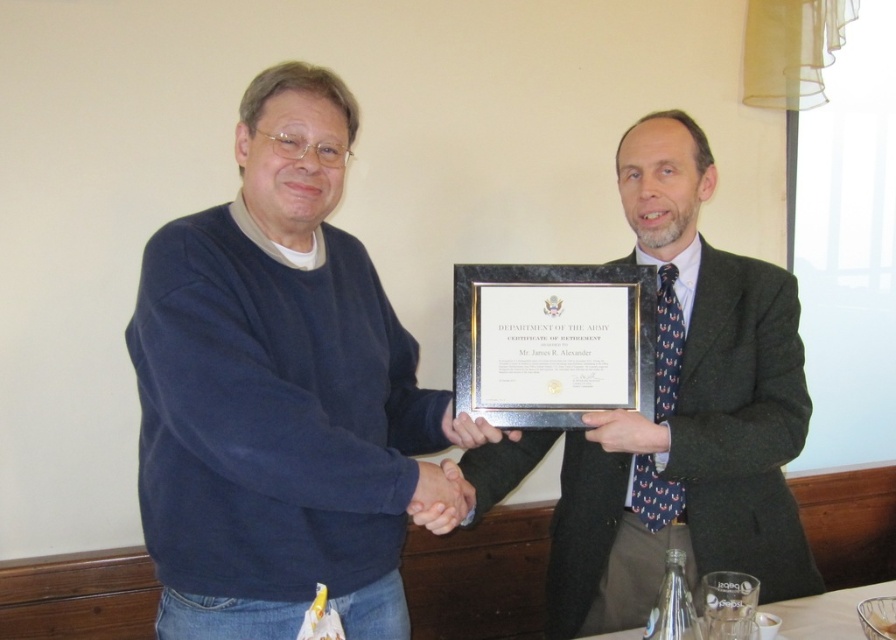
Between matte blue sweater at center and dark gray suit at center, which one appears on the right side from the viewer's perspective?

dark gray suit at center

The image size is (896, 640). In order to click on matte blue sweater at center in this screenshot , I will do `click(280, 392)`.

Does point (369, 289) come behind point (771, 392)?

No, (369, 289) is closer to viewer.

This screenshot has width=896, height=640. Identify the location of matte blue sweater at center. (280, 392).